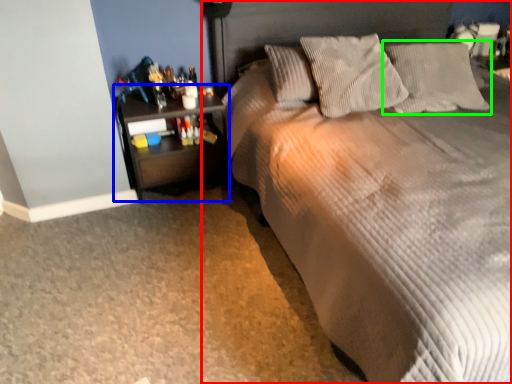
Question: Based on their relative distances, which object is nearer to bed (highlighted by a red box)? Choose from nightstand (highlighted by a blue box) and pillow (highlighted by a green box).

Choices:
 (A) nightstand
 (B) pillow

Answer: (B)